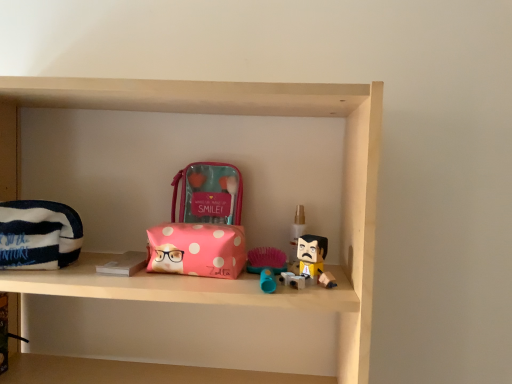
Question: Is translucent plastic spray bottle at center to the right of pink polka dot pouch at center, the first pouch positioned from the back, from the viewer's perspective?

Choices:
 (A) yes
 (B) no

Answer: (A)

Question: Is translucent plastic spray bottle at center smaller than pink polka dot pouch at center, which is the 2th pouch in left-to-right order?

Choices:
 (A) no
 (B) yes

Answer: (B)

Question: Is translucent plastic spray bottle at center aimed at pink polka dot pouch at center, the first pouch positioned from the back?

Choices:
 (A) no
 (B) yes

Answer: (A)

Question: From the image's perspective, does translucent plastic spray bottle at center appear lower than pink polka dot pouch at center, which appears as the second pouch when viewed from the front?

Choices:
 (A) yes
 (B) no

Answer: (A)

Question: Considering the relative sizes of translucent plastic spray bottle at center and pink polka dot pouch at center, the first pouch positioned from the back, in the image provided, is translucent plastic spray bottle at center taller than pink polka dot pouch at center, the first pouch positioned from the back,?

Choices:
 (A) no
 (B) yes

Answer: (A)

Question: In terms of width, does striped fabric pouch at left, positioned as the second pouch in back-to-front order, look wider or thinner when compared to pink polka dot fabric pouch at center?

Choices:
 (A) thin
 (B) wide

Answer: (A)

Question: Which is correct: striped fabric pouch at left, arranged as the 1th pouch when viewed from the left, is inside pink polka dot fabric pouch at center, or outside of it?

Choices:
 (A) outside
 (B) inside

Answer: (A)

Question: Based on their positions, is striped fabric pouch at left, arranged as the 1th pouch when ordered from the bottom, located to the left or right of pink polka dot fabric pouch at center?

Choices:
 (A) left
 (B) right

Answer: (A)

Question: From their relative heights in the image, would you say striped fabric pouch at left, arranged as the 1th pouch when ordered from the bottom, is taller or shorter than pink polka dot fabric pouch at center?

Choices:
 (A) short
 (B) tall

Answer: (B)

Question: Considering the positions of point (30, 243) and point (207, 195), is point (30, 243) closer or farther from the camera than point (207, 195)?

Choices:
 (A) farther
 (B) closer

Answer: (B)

Question: Relative to pink polka dot pouch at center, acting as the first pouch starting from the top, is striped fabric pouch at left, positioned as the second pouch in back-to-front order, in front or behind?

Choices:
 (A) behind
 (B) front

Answer: (B)

Question: From a real-world perspective, relative to pink polka dot pouch at center, acting as the 2th pouch starting from the bottom, is striped fabric pouch at left, arranged as the 1th pouch when viewed from the left, vertically above or below?

Choices:
 (A) above
 (B) below

Answer: (B)

Question: In terms of size, does striped fabric pouch at left, arranged as the 1th pouch when viewed from the left, appear bigger or smaller than pink polka dot pouch at center, which is the 2th pouch in left-to-right order?

Choices:
 (A) small
 (B) big

Answer: (B)

Question: Looking at the image, does striped fabric pouch at left, positioned as the second pouch in back-to-front order, seem bigger or smaller compared to translucent plastic spray bottle at center?

Choices:
 (A) small
 (B) big

Answer: (B)

Question: From the image's perspective, is striped fabric pouch at left, which ranks as the 2th pouch in top-to-bottom order, above or below translucent plastic spray bottle at center?

Choices:
 (A) below
 (B) above

Answer: (A)